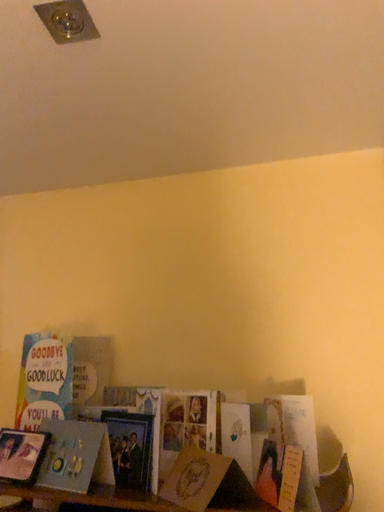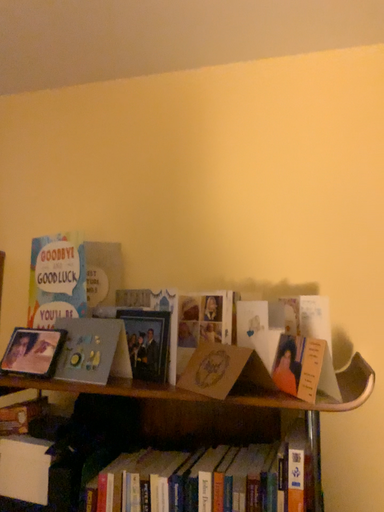
Question: Which way did the camera rotate in the video?

Choices:
 (A) rotated upward
 (B) rotated downward

Answer: (B)